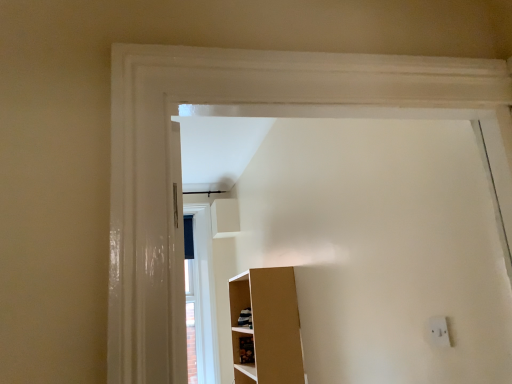
Question: Can you confirm if wooden cabinet at lower center is thinner than white plastic electric outlet at lower right?

Choices:
 (A) no
 (B) yes

Answer: (A)

Question: Can you confirm if wooden cabinet at lower center is taller than white plastic electric outlet at lower right?

Choices:
 (A) no
 (B) yes

Answer: (B)

Question: Is wooden cabinet at lower center turned away from white plastic electric outlet at lower right?

Choices:
 (A) no
 (B) yes

Answer: (A)

Question: Is white plastic electric outlet at lower right a part of wooden cabinet at lower center?

Choices:
 (A) yes
 (B) no

Answer: (B)

Question: Is wooden cabinet at lower center smaller than white plastic electric outlet at lower right?

Choices:
 (A) yes
 (B) no

Answer: (B)

Question: Is wooden cabinet at lower center closer to the viewer compared to white plastic electric outlet at lower right?

Choices:
 (A) no
 (B) yes

Answer: (A)

Question: Can you confirm if white plastic electric outlet at lower right is taller than wooden cabinet at lower center?

Choices:
 (A) yes
 (B) no

Answer: (B)

Question: Considering the relative sizes of white plastic electric outlet at lower right and wooden cabinet at lower center in the image provided, is white plastic electric outlet at lower right wider than wooden cabinet at lower center?

Choices:
 (A) yes
 (B) no

Answer: (B)

Question: Is white plastic electric outlet at lower right completely or partially outside of wooden cabinet at lower center?

Choices:
 (A) yes
 (B) no

Answer: (A)

Question: Does white plastic electric outlet at lower right come in front of wooden cabinet at lower center?

Choices:
 (A) no
 (B) yes

Answer: (B)

Question: Is white plastic electric outlet at lower right positioned with its back to wooden cabinet at lower center?

Choices:
 (A) no
 (B) yes

Answer: (A)

Question: Can wooden cabinet at lower center be found inside white plastic electric outlet at lower right?

Choices:
 (A) yes
 (B) no

Answer: (B)

Question: Is point (434, 334) closer or farther from the camera than point (247, 362)?

Choices:
 (A) farther
 (B) closer

Answer: (B)